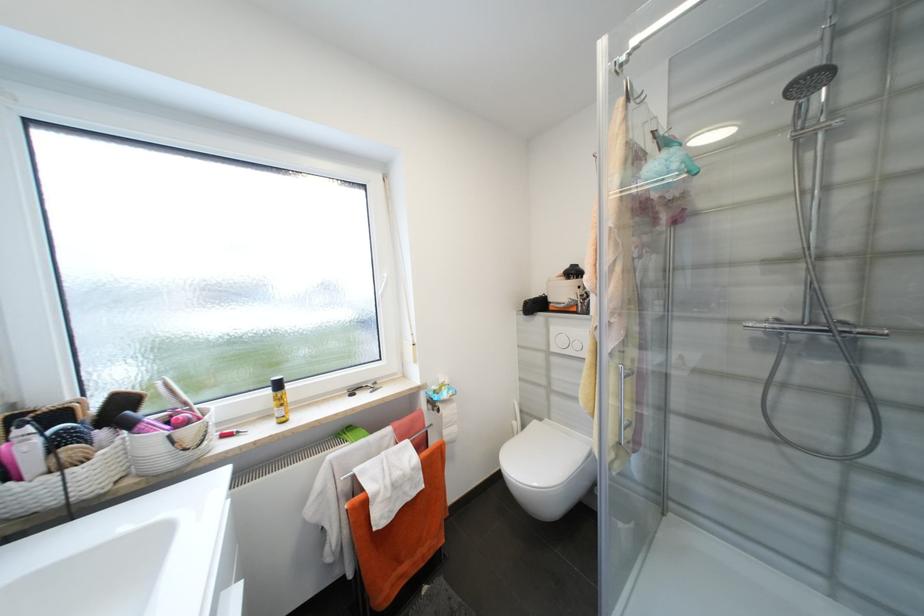
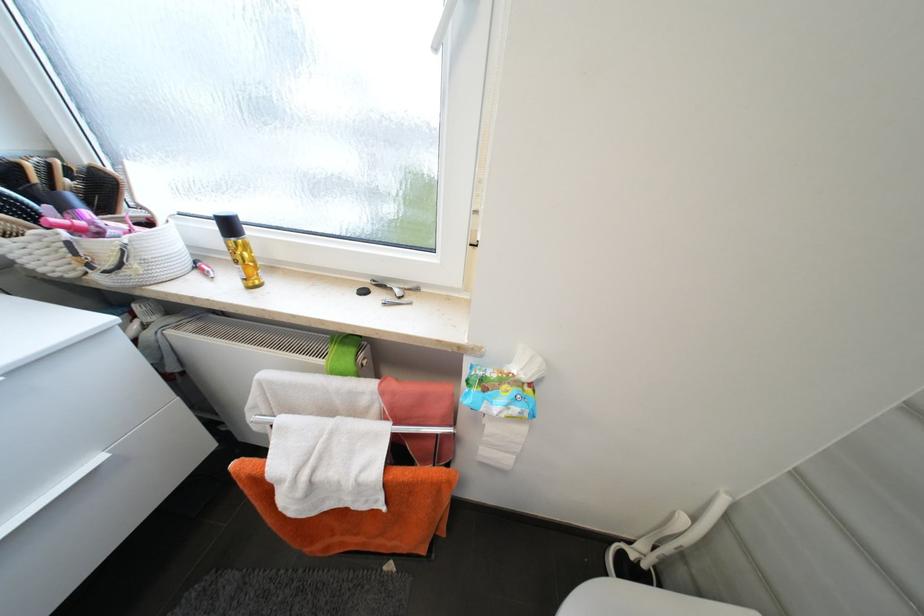
First-person continuous shooting, in which direction is the camera rotating?

The rotation direction of the camera is left-down.